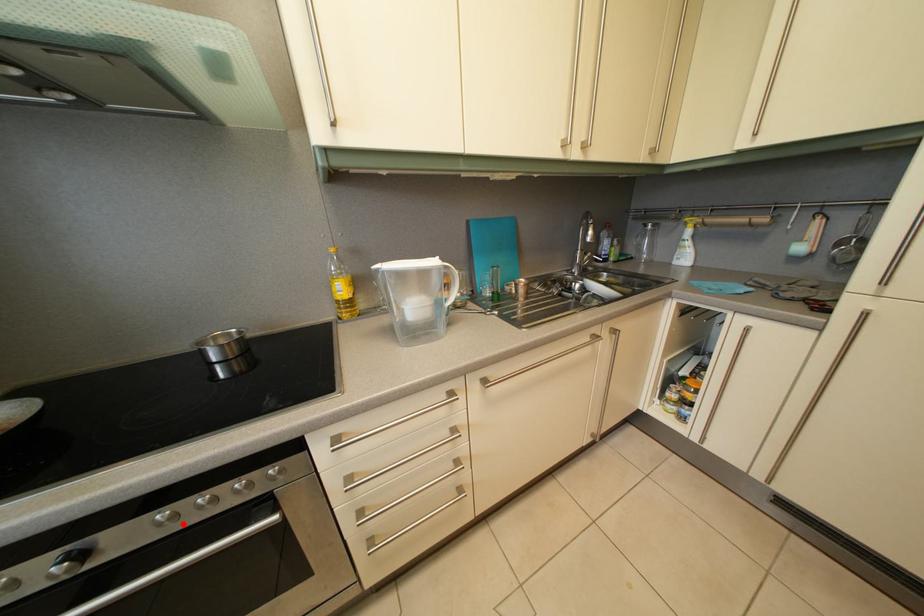
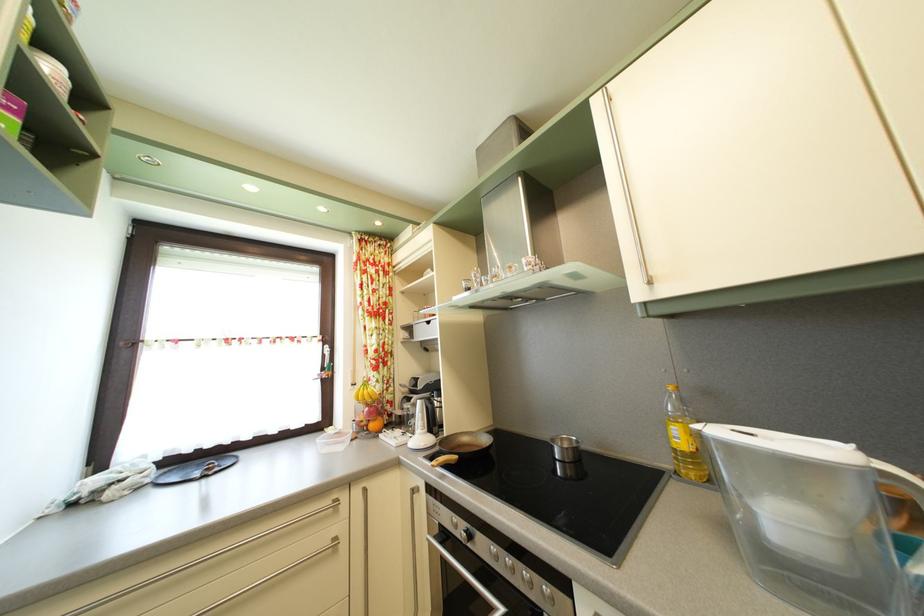
Where in the second image is the point corresponding to the highlighted location from the first image?

(505, 565)